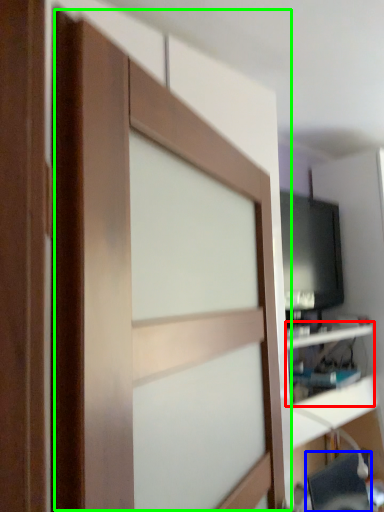
Question: Which object is positioned farthest from shelf (highlighted by a red box)? Select from computer chair (highlighted by a blue box) and barn door (highlighted by a green box).

Choices:
 (A) computer chair
 (B) barn door

Answer: (B)